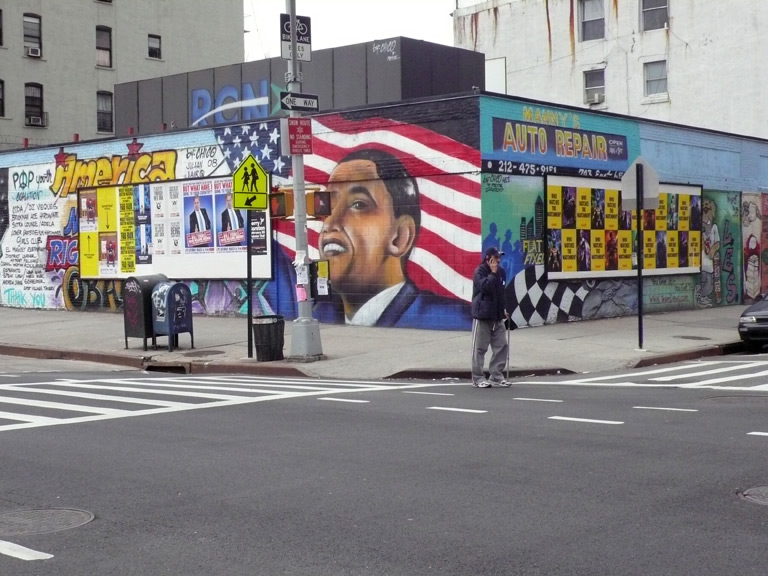
Find the location of a particular element. The width and height of the screenshot is (768, 576). windows is located at coordinates (54, 51).